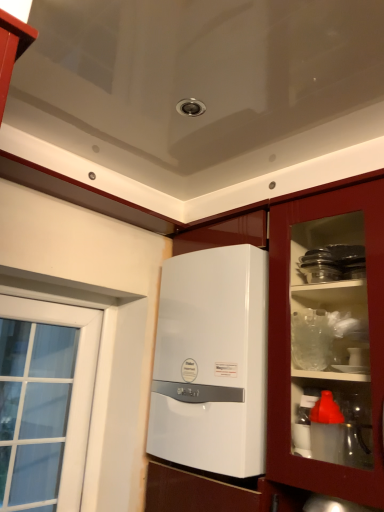
Question: Is point (211, 398) positioned closer to the camera than point (284, 462)?

Choices:
 (A) closer
 (B) farther

Answer: (B)

Question: From the image's perspective, is white glossy boiler at center positioned above or below white glossy cabinet at center?

Choices:
 (A) below
 (B) above

Answer: (B)

Question: Considering the positions of white glossy boiler at center and white glossy cabinet at center in the image, is white glossy boiler at center taller or shorter than white glossy cabinet at center?

Choices:
 (A) tall
 (B) short

Answer: (B)

Question: Is white glossy cabinet at center bigger or smaller than white glossy boiler at center?

Choices:
 (A) big
 (B) small

Answer: (A)

Question: Do you think white glossy cabinet at center is within white glossy boiler at center, or outside of it?

Choices:
 (A) outside
 (B) inside

Answer: (B)

Question: In the image, is white glossy cabinet at center on the left side or the right side of white glossy boiler at center?

Choices:
 (A) left
 (B) right

Answer: (A)

Question: From a real-world perspective, is white glossy cabinet at center physically located above or below white glossy boiler at center?

Choices:
 (A) below
 (B) above

Answer: (A)